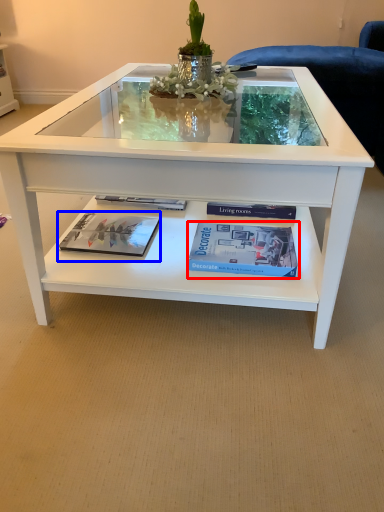
Question: Which object is further to the camera taking this photo, paperback book (highlighted by a red box) or magazine (highlighted by a blue box)?

Choices:
 (A) paperback book
 (B) magazine

Answer: (B)